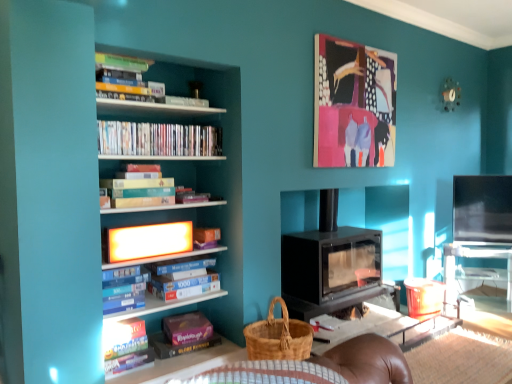
This screenshot has width=512, height=384. Find the location of `empty space that is ontop of matte plastic dvds at upper left, which is the 1th book from top to bottom`. empty space that is ontop of matte plastic dvds at upper left, which is the 1th book from top to bottom is located at coordinates (167, 123).